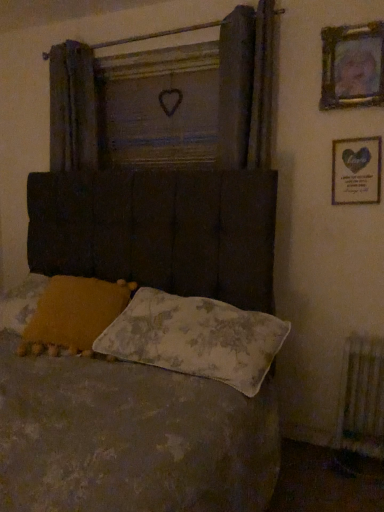
Question: Considering the relative sizes of wooden heart at center and gold-framed picture at upper right, the first picture frame positioned from the top, in the image provided, is wooden heart at center smaller than gold-framed picture at upper right, the first picture frame positioned from the top,?

Choices:
 (A) yes
 (B) no

Answer: (B)

Question: Is there a large distance between wooden heart at center and gold-framed picture at upper right, the second picture frame in the bottom-to-top sequence?

Choices:
 (A) no
 (B) yes

Answer: (A)

Question: From the image's perspective, would you say wooden heart at center is positioned over gold-framed picture at upper right, the second picture frame in the bottom-to-top sequence?

Choices:
 (A) no
 (B) yes

Answer: (A)

Question: Is wooden heart at center taller than gold-framed picture at upper right, the first picture frame positioned from the top?

Choices:
 (A) yes
 (B) no

Answer: (A)

Question: Can gold-framed picture at upper right, the second picture frame in the bottom-to-top sequence, be found inside wooden heart at center?

Choices:
 (A) no
 (B) yes

Answer: (A)

Question: Is gold-framed picture at upper right, the first picture frame positioned from the top, at the back of wooden heart at center?

Choices:
 (A) no
 (B) yes

Answer: (A)

Question: Is floral fabric pillow at center, the first pillow from the right, at the left side of textured fabric bed at center?

Choices:
 (A) yes
 (B) no

Answer: (B)

Question: From a real-world perspective, is floral fabric pillow at center, positioned as the 2th pillow in left-to-right order, physically below textured fabric bed at center?

Choices:
 (A) yes
 (B) no

Answer: (A)

Question: Does floral fabric pillow at center, the first pillow from the right, have a smaller size compared to textured fabric bed at center?

Choices:
 (A) yes
 (B) no

Answer: (A)

Question: Is floral fabric pillow at center, positioned as the 2th pillow in left-to-right order, touching textured fabric bed at center?

Choices:
 (A) no
 (B) yes

Answer: (A)

Question: Could you tell me if floral fabric pillow at center, the first pillow from the right, is turned towards textured fabric bed at center?

Choices:
 (A) no
 (B) yes

Answer: (B)

Question: Does floral fabric pillow at center, positioned as the 2th pillow in left-to-right order, have a greater height compared to textured fabric bed at center?

Choices:
 (A) no
 (B) yes

Answer: (A)

Question: From the image's perspective, is white textured radiator at lower right above fluffy yellow pillow at lower left, positioned as the 2th pillow in right-to-left order?

Choices:
 (A) yes
 (B) no

Answer: (B)